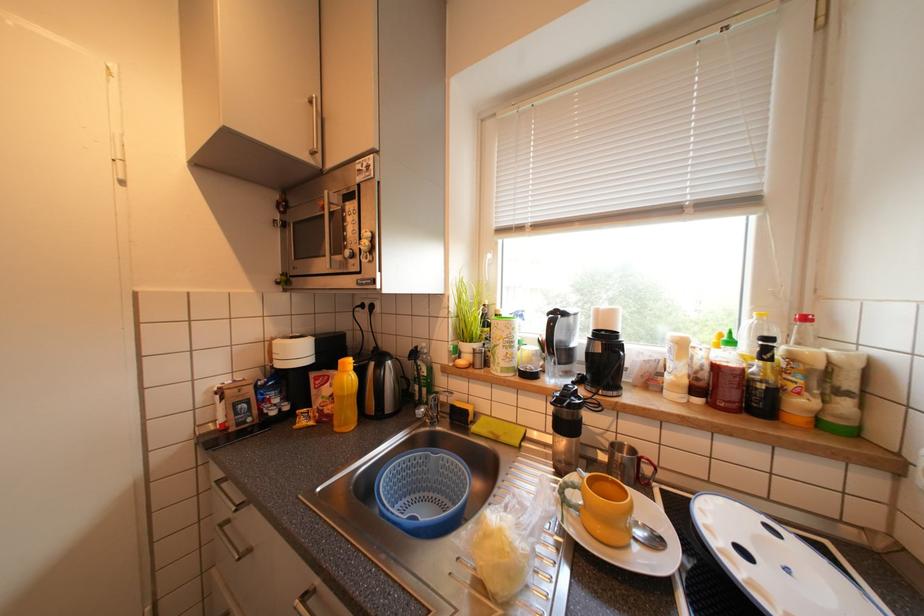
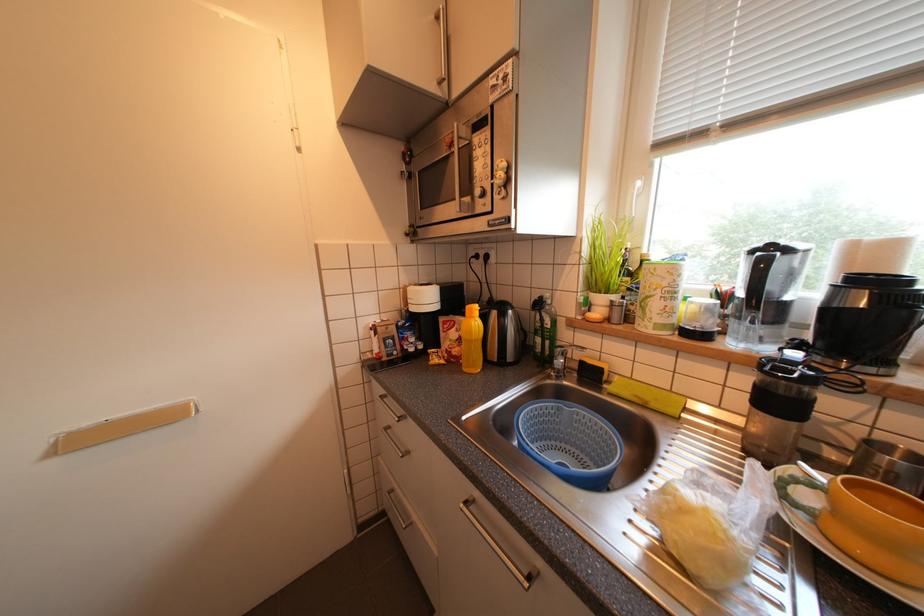
Question: The images are taken continuously from a first-person perspective. In which direction is your viewpoint rotating?

Choices:
 (A) Left
 (B) Right
 (C) Up
 (D) Down

Answer: (A)